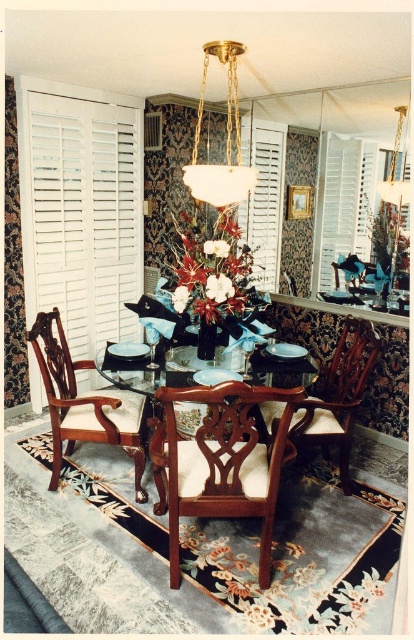
You are standing in the dining room and want to open the white matte shutter at upper center. Based on its position, can you estimate where you should reach to open it?

The white matte shutter at upper center is located at point coordinates 0.317 on the x axis and 0.826 on the y axis, so you should reach towards the upper center area of the room to open it.

You are a painter standing in the dining room and need to hang a large painting that requires a high placement. You can choose between the white wood shutter at left and the white glass chandelier at center. Which object should you choose for hanging the painting based on height?

The white wood shutter at left has a greater height compared to the white glass chandelier at center, so you should choose the white wood shutter at left for hanging the large painting that requires a high placement.

From the picture: You are a guest entering the dining room and notice the white matte shutter at upper center and the wooden chair at center. Which object is positioned higher in the room?

The white matte shutter at upper center is positioned higher in the room than the wooden chair at center because it is located above it.